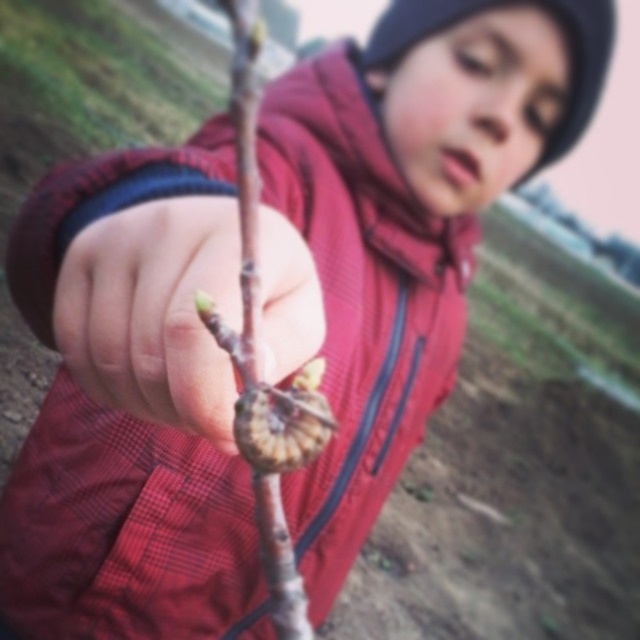
Is smooth skin hand at center shorter than bark-like textured branch at center?

Indeed, smooth skin hand at center has a lesser height compared to bark-like textured branch at center.

Measure the distance from smooth skin hand at center to bark-like textured branch at center.

smooth skin hand at center and bark-like textured branch at center are 24.65 feet apart from each other.

Where is `smooth skin hand at center`? The height and width of the screenshot is (640, 640). smooth skin hand at center is located at coordinates (154, 312).